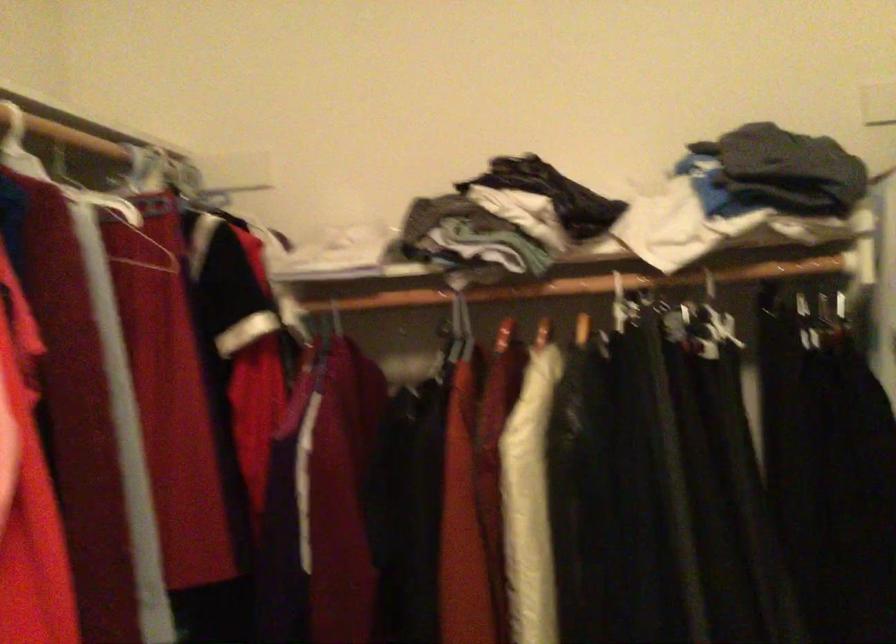
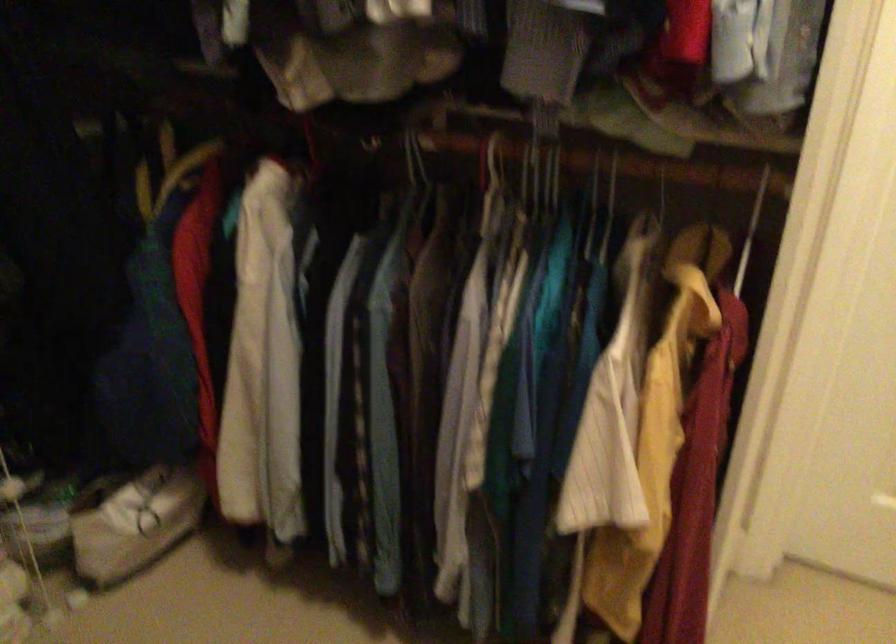
The images are taken continuously from a first-person perspective. In which direction is your viewpoint rotating?

The camera's rotation is toward right-down.